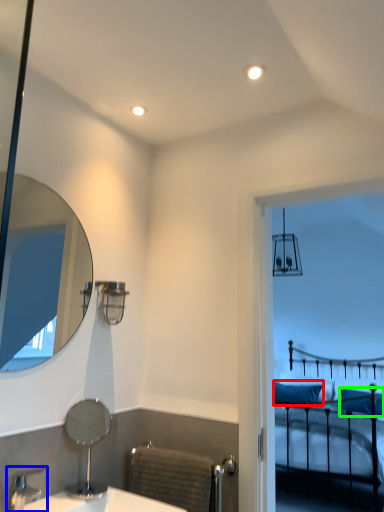
Question: Which object is positioned closest to pillow (highlighted by a red box)? Select from tap (highlighted by a blue box) and pillow (highlighted by a green box).

Choices:
 (A) tap
 (B) pillow

Answer: (B)